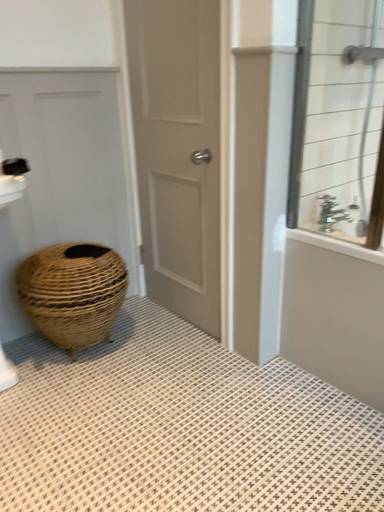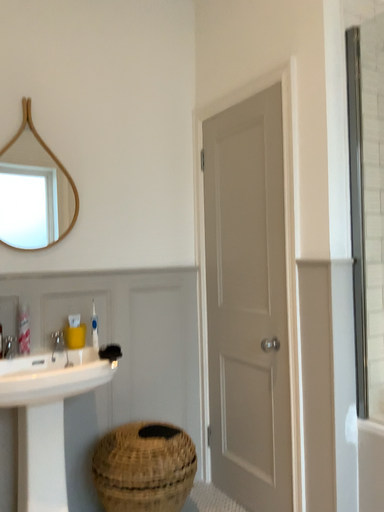
Question: How did the camera likely rotate when shooting the video?

Choices:
 (A) rotated left
 (B) rotated right

Answer: (A)